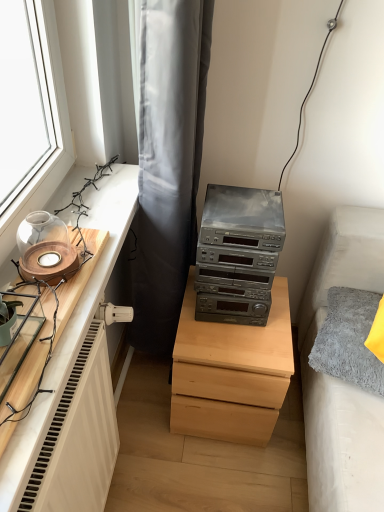
The height and width of the screenshot is (512, 384). I want to click on free spot in front of wooden candle holder at left, so click(x=40, y=306).